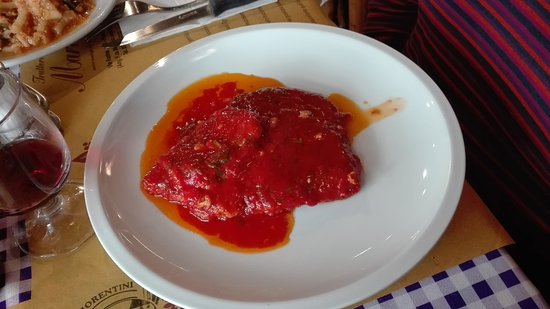
You are a GUI agent. You are given a task and a screenshot of the screen. Output one action in this format:
    pyautogui.click(x=<x>, y=<y>)
    Task: Click on the striped fabric
    
    Given the screenshot: What is the action you would take?
    pyautogui.click(x=517, y=75)